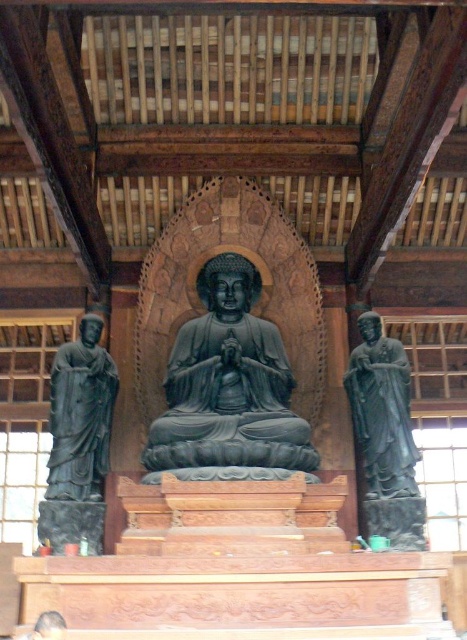
Is black stone statue at center to the left of black polished statue at right from the viewer's perspective?

Indeed, black stone statue at center is positioned on the left side of black polished statue at right.

Is black stone statue at center further to camera compared to black polished statue at right?

No, black stone statue at center is in front of black polished statue at right.

Does point (207, 275) come behind point (382, 376)?

Yes, point (207, 275) is behind point (382, 376).

This screenshot has height=640, width=467. In order to click on black stone statue at center in this screenshot , I will do `click(228, 390)`.

Who is more distant from viewer, (199,356) or (73,436)?

The point (199,356) is more distant.

Can you confirm if black stone statue at center is shorter than matte black statue at left?

No.

Locate an element on the screen. black stone statue at center is located at coordinates (228, 390).

Measure the distance between matte black statue at left and black polished statue at right.

They are 86.74 feet apart.

In the scene shown: Does matte black statue at left have a lesser width compared to black polished statue at right?

Yes.

Identify the location of matte black statue at left. The height and width of the screenshot is (640, 467). (80, 416).

At what (x,y) coordinates should I click in order to perform the action: click on matte black statue at left. Please return your answer as a coordinate pair (x, y). The image size is (467, 640). Looking at the image, I should click on (80, 416).